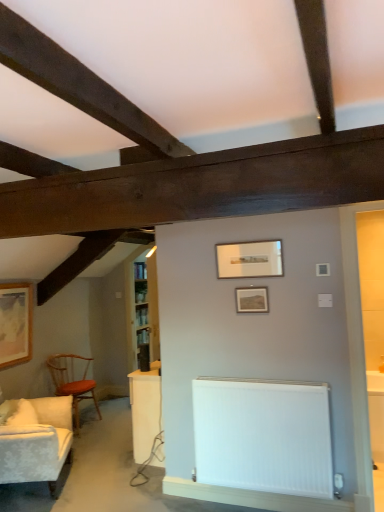
Question: Is wooden framed picture at left, which is the 3th picture frame in front-to-back order, at the back of matte wooden picture frame at center, positioned as the 1th picture frame in right-to-left order?

Choices:
 (A) no
 (B) yes

Answer: (A)

Question: Is matte wooden picture frame at center, which is the second picture frame in front-to-back order, with wooden framed picture at left, positioned as the third picture frame in top-to-bottom order?

Choices:
 (A) no
 (B) yes

Answer: (A)

Question: Is matte wooden picture frame at center, arranged as the 2th picture frame when ordered from the bottom, facing towards wooden framed picture at left, which is the 3th picture frame in front-to-back order?

Choices:
 (A) no
 (B) yes

Answer: (A)

Question: Is matte wooden picture frame at center, which is the second picture frame in front-to-back order, to the right of wooden framed picture at left, positioned as the third picture frame in top-to-bottom order, from the viewer's perspective?

Choices:
 (A) no
 (B) yes

Answer: (B)

Question: Considering the relative sizes of matte wooden picture frame at center, positioned as the 2th picture frame in back-to-front order, and wooden framed picture at left, positioned as the third picture frame in top-to-bottom order, in the image provided, is matte wooden picture frame at center, positioned as the 2th picture frame in back-to-front order, wider than wooden framed picture at left, positioned as the third picture frame in top-to-bottom order,?

Choices:
 (A) yes
 (B) no

Answer: (B)

Question: Considering the relative sizes of matte wooden picture frame at center, which ranks as the 3th picture frame in left-to-right order, and wooden framed picture at left, positioned as the third picture frame in top-to-bottom order, in the image provided, is matte wooden picture frame at center, which ranks as the 3th picture frame in left-to-right order, smaller than wooden framed picture at left, positioned as the third picture frame in top-to-bottom order,?

Choices:
 (A) yes
 (B) no

Answer: (A)

Question: Does wooden framed picture at left, positioned as the third picture frame in top-to-bottom order, have a larger size compared to white smooth radiator at lower center?

Choices:
 (A) yes
 (B) no

Answer: (B)

Question: Would you say white smooth radiator at lower center is part of wooden framed picture at left, the 3th picture frame from the right,'s contents?

Choices:
 (A) no
 (B) yes

Answer: (A)

Question: From the image's perspective, does wooden framed picture at left, marked as the 1th picture frame in a back-to-front arrangement, appear lower than white smooth radiator at lower center?

Choices:
 (A) yes
 (B) no

Answer: (B)

Question: Considering the relative sizes of wooden framed picture at left, positioned as the third picture frame in top-to-bottom order, and white smooth radiator at lower center in the image provided, is wooden framed picture at left, positioned as the third picture frame in top-to-bottom order, taller than white smooth radiator at lower center?

Choices:
 (A) no
 (B) yes

Answer: (B)

Question: Can you see wooden framed picture at left, which is the 3th picture frame in front-to-back order, touching white smooth radiator at lower center?

Choices:
 (A) no
 (B) yes

Answer: (A)

Question: Considering the relative sizes of wooden framed picture at left, which is counted as the 1th picture frame, starting from the bottom, and white smooth radiator at lower center in the image provided, is wooden framed picture at left, which is counted as the 1th picture frame, starting from the bottom, smaller than white smooth radiator at lower center?

Choices:
 (A) no
 (B) yes

Answer: (B)

Question: Is wooden framed picture at left, the 3th picture frame from the right, at the right side of white glossy table at lower right?

Choices:
 (A) yes
 (B) no

Answer: (B)